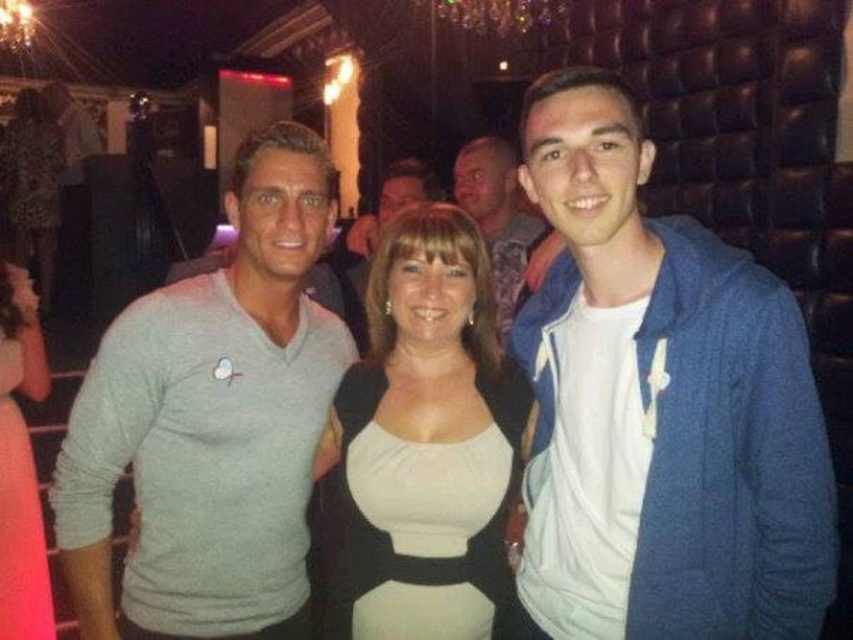
You are a photographer adjusting the lighting for a group photo. You notice the matte black dress at center and the blue cotton hoodie at center. Which clothing item should you focus on first if you want to ensure both are well lit, considering their sizes?

The matte black dress at center is much taller than the blue cotton hoodie at center, so you should focus on lighting the matte black dress at center first to ensure proper exposure for its larger size.

You are a photographer trying to adjust the lighting for a photo. You notice the blue corduroy jacket at center and the gray matte sweater at left. Which clothing item is closer to the camera?

The blue corduroy jacket at center is closer to the camera because it is in front of the gray matte sweater at left.